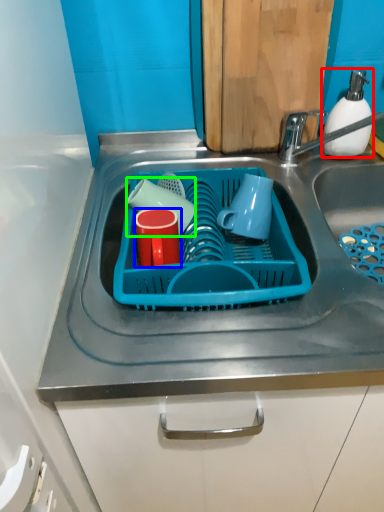
Question: Which object is the farthest from soap dispenser (highlighted by a red box)? Choose among these: tableware (highlighted by a blue box) or tableware (highlighted by a green box).

Choices:
 (A) tableware
 (B) tableware

Answer: (A)